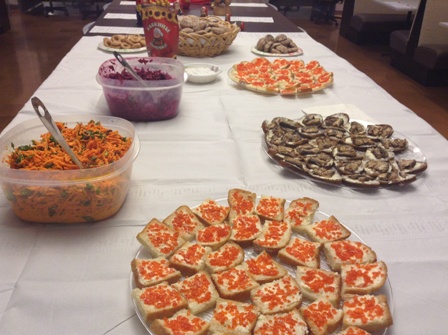
In order to click on tablecloth in this screenshot , I will do `click(213, 162)`.